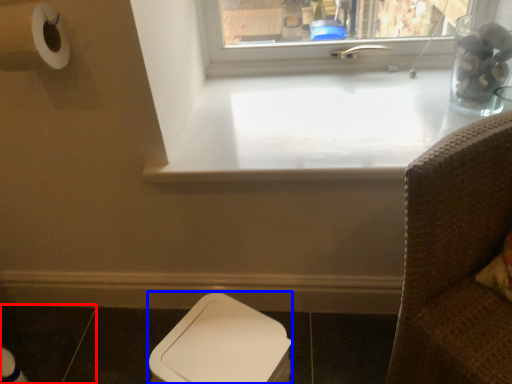
Question: Which object is further to the camera taking this photo, tile (highlighted by a red box) or toilet bowl (highlighted by a blue box)?

Choices:
 (A) tile
 (B) toilet bowl

Answer: (A)